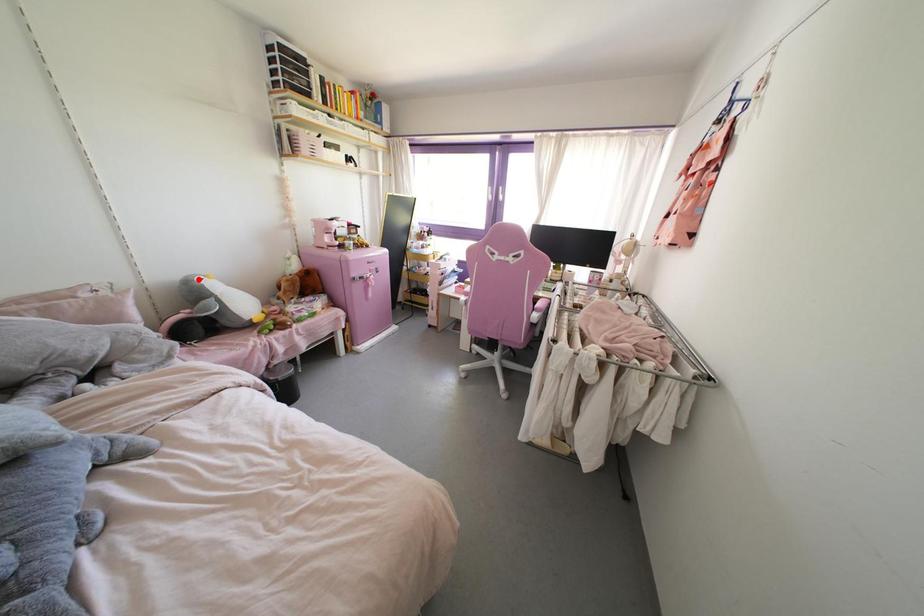
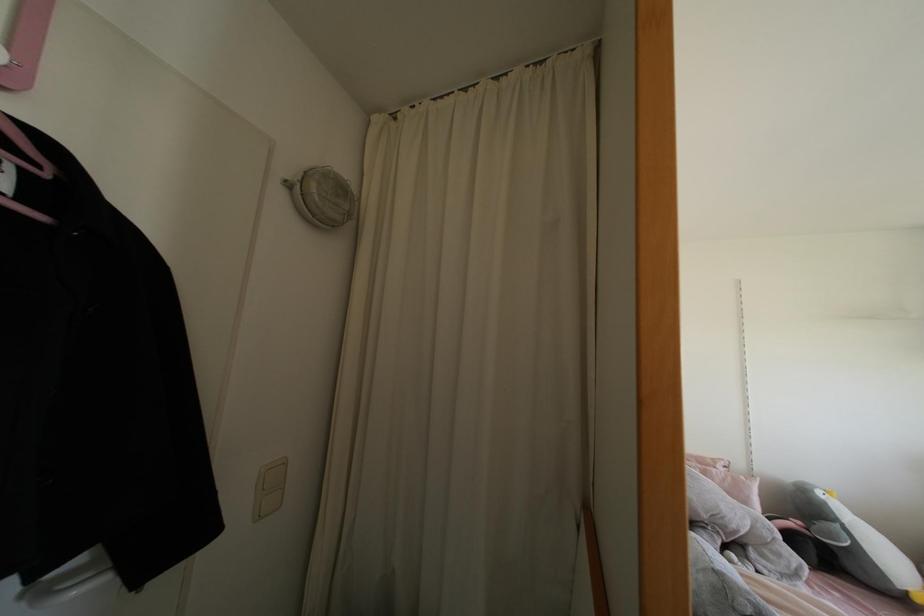
Question: I am providing you with two images of the same scene from different viewpoints. A red point is shown in image1. For the corresponding object point in image2, is it positioned nearer or farther from the camera?

Choices:
 (A) Nearer
 (B) Farther

Answer: (A)